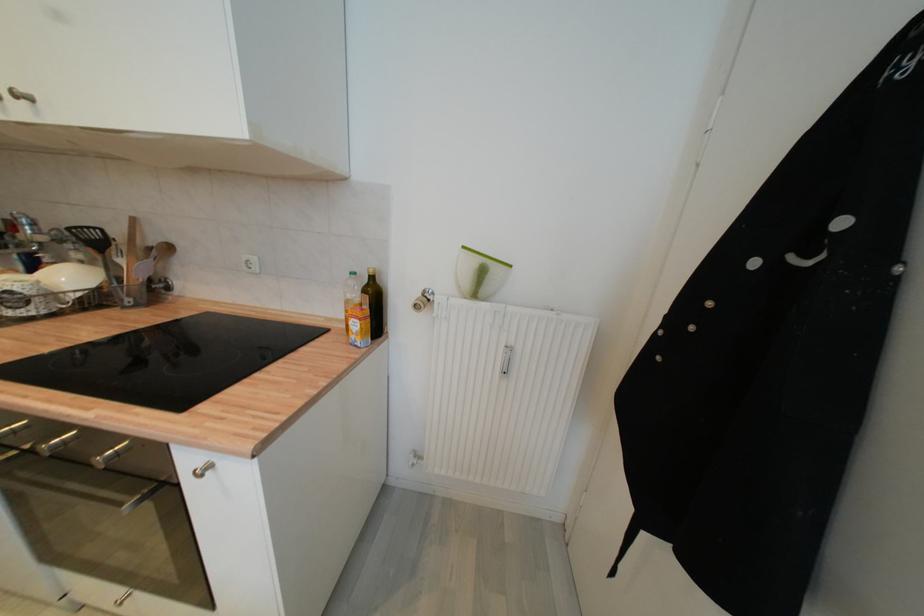
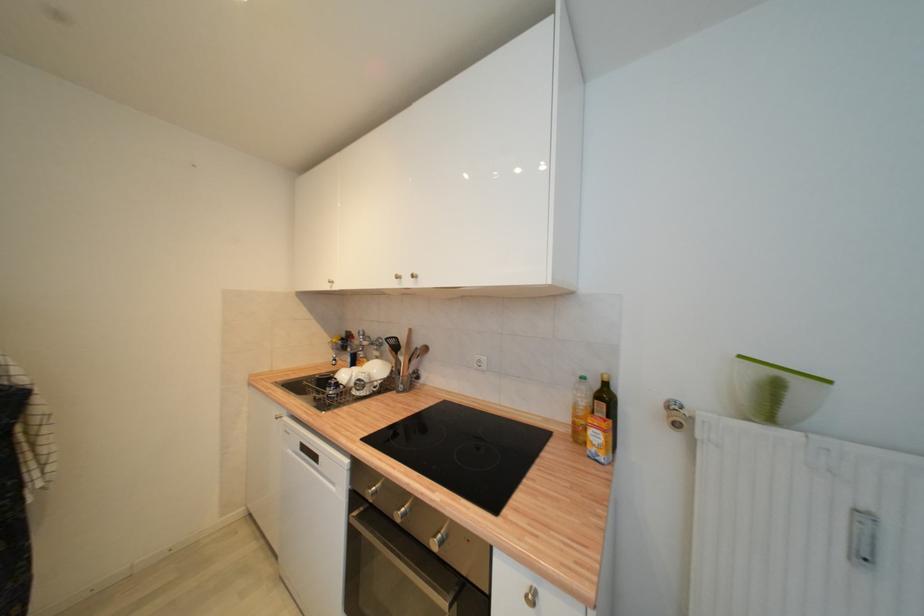
The point at (74, 230) is marked in the first image. Where is the corresponding point in the second image?

(392, 341)